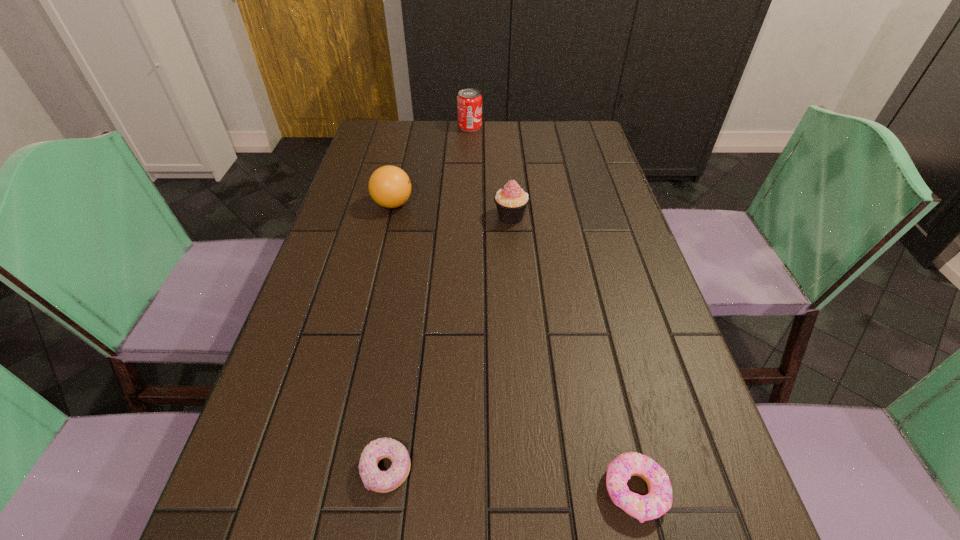
The width and height of the screenshot is (960, 540). In order to click on the farthest object in this screenshot , I will do `click(469, 101)`.

Image resolution: width=960 pixels, height=540 pixels. I want to click on the third object from left to right, so click(x=469, y=101).

You are a GUI agent. You are given a task and a screenshot of the screen. Output one action in this format:
    pyautogui.click(x=<x>, y=<y>)
    Task: Click on the cupcake
    This screenshot has width=960, height=540.
    Given the screenshot: What is the action you would take?
    [x=511, y=201]

Where is `ping-pong ball`? This screenshot has width=960, height=540. ping-pong ball is located at coordinates (389, 186).

What are the coordinates of `the left doughnut` in the screenshot? It's located at (373, 479).

This screenshot has width=960, height=540. In order to click on the right doughnut in this screenshot , I will do `click(658, 501)`.

Find the location of a particular element. The height and width of the screenshot is (540, 960). blank space located 0.160m on the left of the farthest object is located at coordinates (412, 127).

The image size is (960, 540). Identify the location of blank space located 0.340m on the back of the second object from right to left. (505, 145).

Locate an element on the screen. This screenshot has height=540, width=960. vacant space located 0.270m on the side with brand of the ping-pong ball is located at coordinates (513, 204).

You are a GUI agent. You are given a task and a screenshot of the screen. Output one action in this format:
    pyautogui.click(x=<x>, y=<y>)
    Task: Click on the vacant region located 0.050m on the left of the left doughnut
    The height and width of the screenshot is (540, 960).
    Given the screenshot: What is the action you would take?
    pyautogui.click(x=330, y=470)